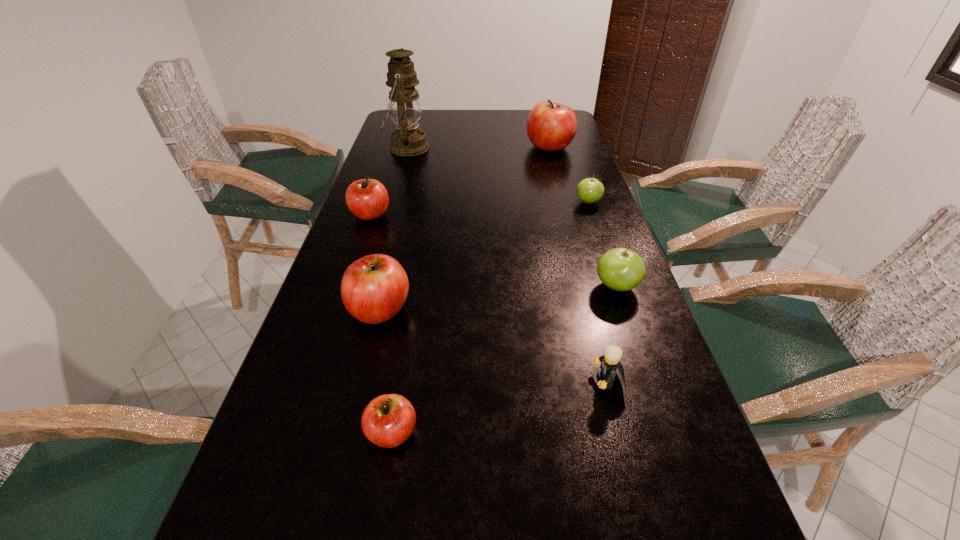
This screenshot has height=540, width=960. Find the location of `the nearest apple`. the nearest apple is located at coordinates coord(387,421).

The height and width of the screenshot is (540, 960). In order to click on the nearest red apple in this screenshot , I will do `click(387, 421)`.

Find the location of `vacant space located on the front of the green oil lamp`. vacant space located on the front of the green oil lamp is located at coordinates (398, 178).

At what (x,y) coordinates should I click in order to perform the action: click on vacant position located 0.190m on the back of the rightmost red apple. Please return your answer as a coordinate pair (x, y). Looking at the image, I should click on [541, 118].

What are the coordinates of `vacant region located on the right of the fifth shortest apple` in the screenshot? It's located at (443, 310).

Locate an element on the screen. This screenshot has height=540, width=960. free space located 0.250m on the front of the bigger green apple is located at coordinates (655, 397).

At what (x,y) coordinates should I click in order to perform the action: click on vacant area situated 0.330m on the right of the third nearest red apple. Please return your answer as a coordinate pair (x, y). This screenshot has width=960, height=540. Looking at the image, I should click on (505, 215).

Where is `vacant space located on the front-facing side of the Lego`? The image size is (960, 540). vacant space located on the front-facing side of the Lego is located at coordinates (530, 381).

The height and width of the screenshot is (540, 960). What are the coordinates of `free space located 0.330m on the front-facing side of the Lego` in the screenshot? It's located at (420, 381).

Where is `free region located on the front-facing side of the Lego`? free region located on the front-facing side of the Lego is located at coordinates pyautogui.click(x=452, y=381).